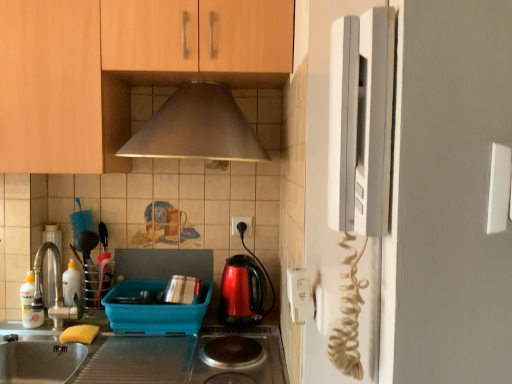
Question: Is metallic utensil holder at left, the 2th appliance in the left-to-right sequence, wider or thinner than white plastic electric outlet at center, arranged as the first electric outlet when viewed from the left?

Choices:
 (A) wide
 (B) thin

Answer: (A)

Question: Based on their sizes in the image, would you say metallic utensil holder at left, acting as the 2th appliance starting from the right, is bigger or smaller than white plastic electric outlet at center, which is the 1th electric outlet from back to front?

Choices:
 (A) small
 (B) big

Answer: (B)

Question: Based on their relative distances, which object is farther from the wooden cabinet at upper center?

Choices:
 (A) white plastic electric outlet at center, which is counted as the 2th electric outlet, starting from the front
 (B) brushed metal faucet at left, positioned as the 1th appliance in left-to-right order
 (C) metallic silver exhaust hood at upper center
 (D) shiny metallic stove at center
 (E) white plastic sink at left

Answer: (D)

Question: Estimate the real-world distances between objects in this image. Which object is closer to the matte plastic dish rack at lower center, the 3th appliance positioned from the left?

Choices:
 (A) white glossy bottle at sink left, which is the second bottle from left to right
 (B) white plastic electric outlet at center, which is counted as the 2th electric outlet, starting from the front
 (C) metallic silver exhaust hood at upper center
 (D) white plastic electrical outlet at right, acting as the second electric outlet starting from the back
 (E) shiny plastic kettle at center

Answer: (E)